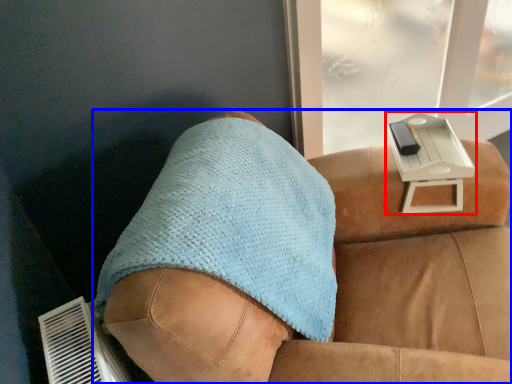
Question: Which point is further to the camera, table (highlighted by a red box) or furniture (highlighted by a blue box)?

Choices:
 (A) table
 (B) furniture

Answer: (A)